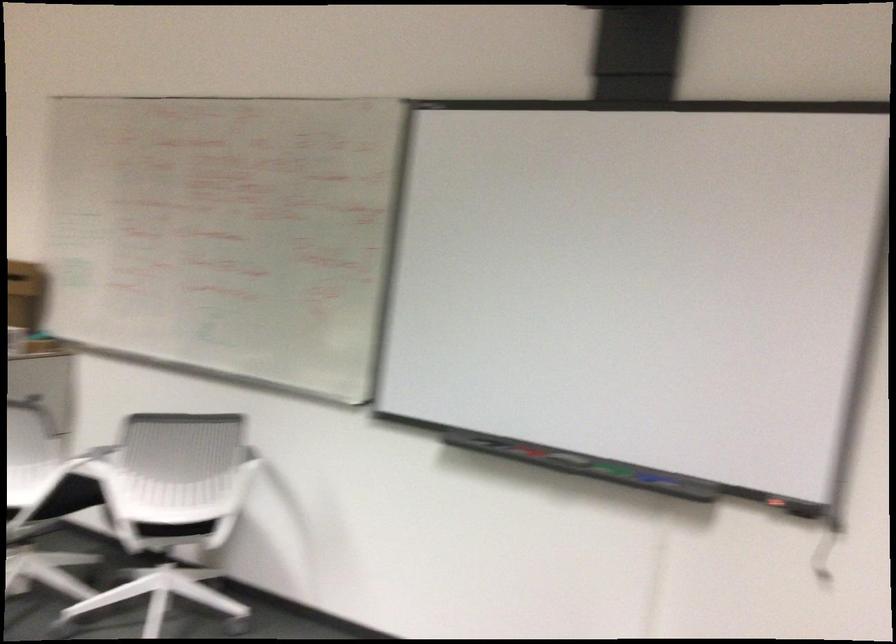
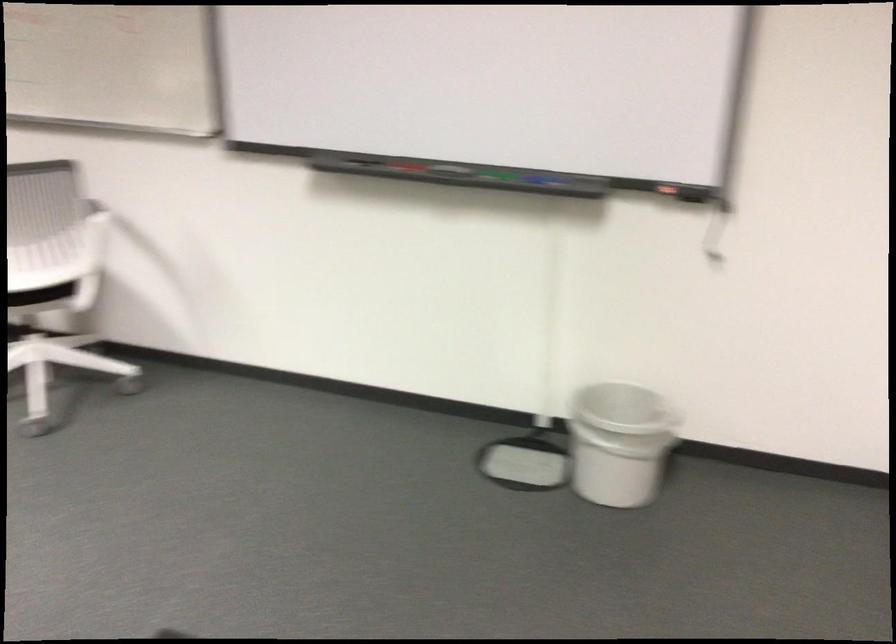
Question: Which direction would the cameraman need to move to produce the second image? Reply with the corresponding letter.

Choices:
 (A) Left
 (B) Right
 (C) Forward
 (D) Backward

Answer: (C)